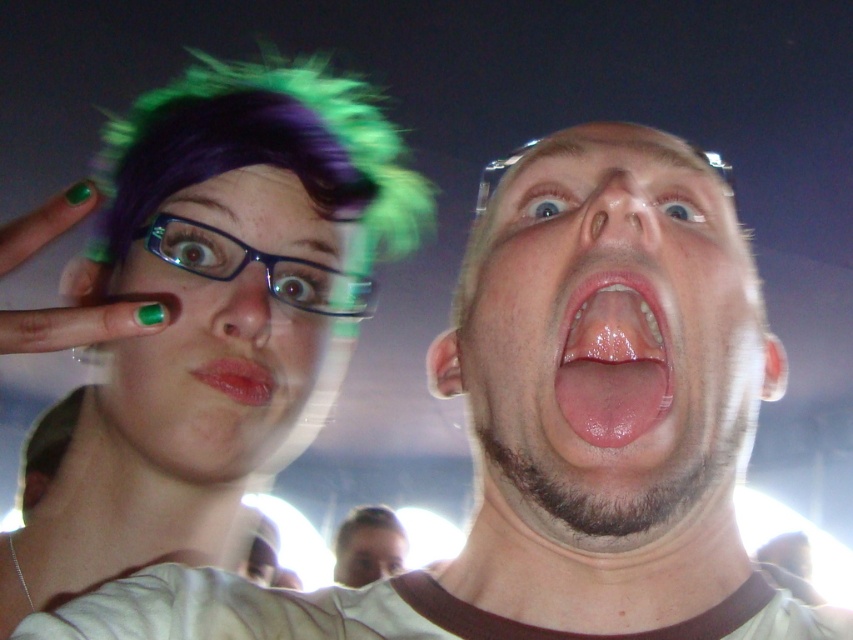
Question: Which of the following is the closest to the observer?

Choices:
 (A) (309, 326)
 (B) (337, 580)

Answer: (A)

Question: Which object is positioned closest to the smooth skin face at center?

Choices:
 (A) smooth skin face at upper right
 (B) shiny plastic hair at upper left
 (C) pink glossy tongue at center

Answer: (B)

Question: Which point is closer to the camera?

Choices:
 (A) (219, 362)
 (B) (326, 84)

Answer: (A)

Question: Is shiny plastic hair at upper left further to the viewer compared to pink glossy tongue at center?

Choices:
 (A) no
 (B) yes

Answer: (A)

Question: Is smooth skin face at upper right positioned in front of smooth skin face at center?

Choices:
 (A) no
 (B) yes

Answer: (B)

Question: Where is matte blue glasses at upper left located in relation to smooth skin face at center in the image?

Choices:
 (A) below
 (B) above

Answer: (B)